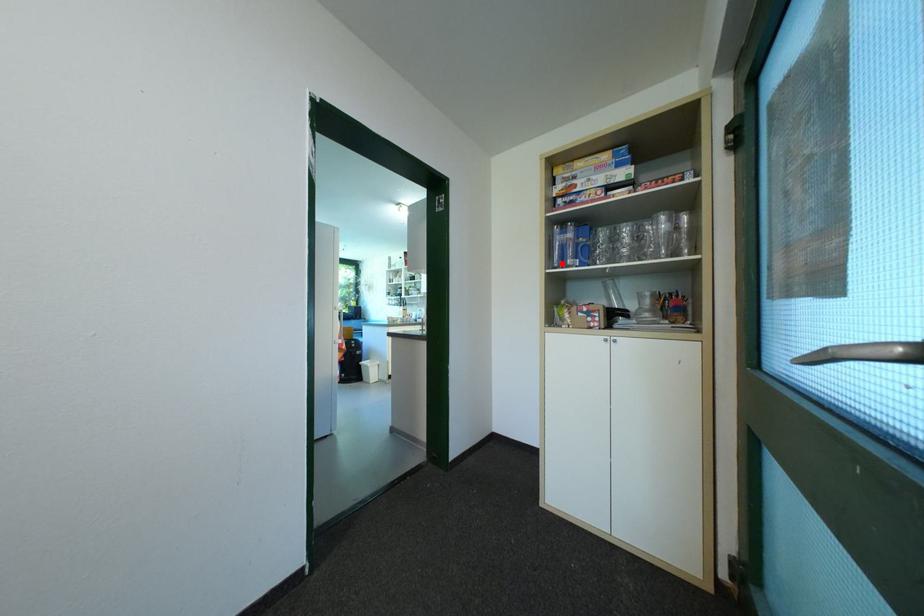
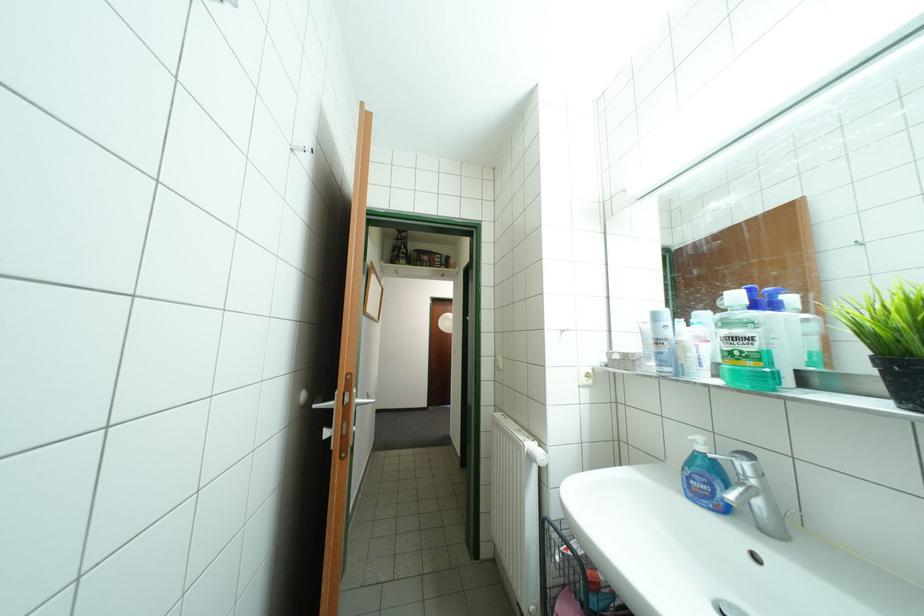
Question: I am providing you with two images of the same scene from different viewpoints. A red point is marked on the first image. Can you still see the location of the red point in image 2?

Choices:
 (A) Yes
 (B) No

Answer: (B)